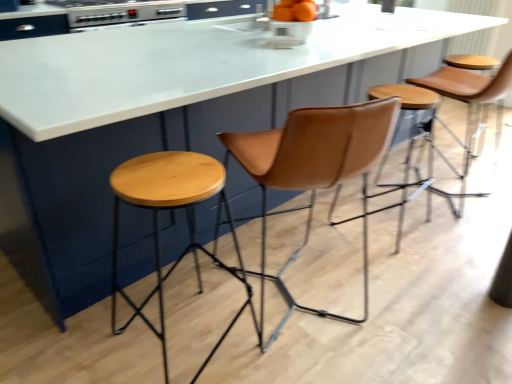
This screenshot has height=384, width=512. What do you see at coordinates (124, 15) in the screenshot?
I see `metallic silver oven at upper left` at bounding box center [124, 15].

Describe the element at coordinates (315, 169) in the screenshot. Image resolution: width=512 pixels, height=384 pixels. I see `brown leather swivel chair at center` at that location.

What do you see at coordinates (295, 11) in the screenshot? I see `orange matte bowl at center` at bounding box center [295, 11].

What do you see at coordinates (413, 148) in the screenshot? I see `leather stool at center, the second stool from the front` at bounding box center [413, 148].

This screenshot has height=384, width=512. What are the coordinates of `metallic silver oven at upper left` in the screenshot? It's located at (124, 15).

Is point (169, 185) positioned behind point (137, 20)?

No.

From the image's perspective, relative to metallic silver oven at upper left, is natural wood stool at left, positioned as the 2th stool in right-to-left order, above or below?

Based on their image positions, natural wood stool at left, positioned as the 2th stool in right-to-left order, is located beneath metallic silver oven at upper left.

Does natural wood stool at left, which is counted as the second stool, starting from the back, have a greater height compared to metallic silver oven at upper left?

Yes.

How much distance is there between natural wood stool at left, positioned as the 2th stool in right-to-left order, and metallic silver oven at upper left?

natural wood stool at left, positioned as the 2th stool in right-to-left order, is 2.05 meters from metallic silver oven at upper left.

Could you tell me if leather stool at center, the second stool positioned from the left, is turned towards natural wood stool at left, which is counted as the second stool, starting from the back?

No, leather stool at center, the second stool positioned from the left, is not turned towards natural wood stool at left, which is counted as the second stool, starting from the back.

Can you confirm if leather stool at center, the second stool positioned from the left, is positioned to the left of natural wood stool at left, which is counted as the second stool, starting from the back?

Incorrect, leather stool at center, the second stool positioned from the left, is not on the left side of natural wood stool at left, which is counted as the second stool, starting from the back.

Consider the image. Is leather stool at center, the second stool from the front, closer to the viewer compared to natural wood stool at left, which is counted as the second stool, starting from the back?

No, leather stool at center, the second stool from the front, is behind natural wood stool at left, which is counted as the second stool, starting from the back.

From the image's perspective, is leather stool at center, the 1th stool from the back, above or below natural wood stool at left, the first stool from the front?

From the image's perspective, leather stool at center, the 1th stool from the back, appears above natural wood stool at left, the first stool from the front.

Which is closer to the camera, (394, 85) or (139, 10)?

The point (394, 85) is closer.

Looking at this image, from the image's perspective, is leather stool at center, the second stool from the front, above metallic silver oven at upper left?

No, from the image's perspective, leather stool at center, the second stool from the front, is not on top of metallic silver oven at upper left.

Can metallic silver oven at upper left be found inside leather stool at center, the second stool positioned from the left?

No, metallic silver oven at upper left is not inside leather stool at center, the second stool positioned from the left.

From a real-world perspective, is orange matte bowl at center above or below brown leather swivel chair at center?

Clearly, from a real-world perspective, orange matte bowl at center is above brown leather swivel chair at center.

Does orange matte bowl at center appear on the right side of brown leather swivel chair at center?

Yes, orange matte bowl at center is to the right of brown leather swivel chair at center.

The image size is (512, 384). Identify the location of swivel chair in front of the orange matte bowl at center. (315, 169).

Can you tell me how much metallic silver oven at upper left and orange matte bowl at center differ in facing direction?

metallic silver oven at upper left and orange matte bowl at center are facing 1.05 degrees away from each other.

Is metallic silver oven at upper left outside of orange matte bowl at center?

Indeed, metallic silver oven at upper left is completely outside orange matte bowl at center.

Is metallic silver oven at upper left thinner than orange matte bowl at center?

No.

Where is `orange in front of the metallic silver oven at upper left`? The width and height of the screenshot is (512, 384). orange in front of the metallic silver oven at upper left is located at coordinates (295, 11).

Is brown leather swivel chair at center facing towards leather stool at center, the second stool from the front?

No, brown leather swivel chair at center does not turn towards leather stool at center, the second stool from the front.

Based on their positions, is brown leather swivel chair at center located to the left or right of leather stool at center, the second stool from the front?

Clearly, brown leather swivel chair at center is on the left of leather stool at center, the second stool from the front, in the image.

From a real-world perspective, is brown leather swivel chair at center above or below leather stool at center, which ranks as the 1th stool in right-to-left order?

From a real-world perspective, brown leather swivel chair at center is physically above leather stool at center, which ranks as the 1th stool in right-to-left order.

Can natural wood stool at left, which is counted as the second stool, starting from the back, be found inside orange matte bowl at center?

No, natural wood stool at left, which is counted as the second stool, starting from the back, is not inside orange matte bowl at center.

Is orange matte bowl at center in front of or behind natural wood stool at left, which is the first stool from left to right, in the image?

orange matte bowl at center is behind natural wood stool at left, which is the first stool from left to right.

From the image's perspective, would you say orange matte bowl at center is shown under natural wood stool at left, which is counted as the second stool, starting from the back?

No, from the image's perspective, orange matte bowl at center is not beneath natural wood stool at left, which is counted as the second stool, starting from the back.

At what (x,y) coordinates should I click in order to perform the action: click on appliance that is above the natural wood stool at left, the first stool from the front (from the image's perspective). Please return your answer as a coordinate pair (x, y). Image resolution: width=512 pixels, height=384 pixels. Looking at the image, I should click on (124, 15).

The image size is (512, 384). What are the coordinates of `stool that appears below the leather stool at center, which ranks as the 1th stool in right-to-left order (from a real-world perspective)` in the screenshot? It's located at (159, 224).

Looking at the image, which one is located further to brown leather swivel chair at center, leather stool at center, the second stool from the front, or metallic silver oven at upper left?

metallic silver oven at upper left is further to brown leather swivel chair at center.

Estimate the real-world distances between objects in this image. Which object is closer to leather stool at center, the second stool positioned from the left, brown leather swivel chair at center or natural wood stool at left, the first stool from the front?

natural wood stool at left, the first stool from the front, is positioned closer to the anchor leather stool at center, the second stool positioned from the left.

Which object lies further to the anchor point orange matte bowl at center, natural wood stool at left, positioned as the 2th stool in right-to-left order, or metallic silver oven at upper left?

Based on the image, metallic silver oven at upper left appears to be further to orange matte bowl at center.

Which object lies nearer to the anchor point orange matte bowl at center, leather stool at center, the second stool positioned from the left, or metallic silver oven at upper left?

leather stool at center, the second stool positioned from the left.

Looking at this image, based on their spatial positions, is brown leather swivel chair at center or metallic silver oven at upper left closer to leather stool at center, the second stool from the front?

brown leather swivel chair at center is positioned closer to the anchor leather stool at center, the second stool from the front.

From the image, which object appears to be farther from natural wood stool at left, positioned as the 2th stool in right-to-left order, leather stool at center, the second stool positioned from the left, or brown leather swivel chair at center?

leather stool at center, the second stool positioned from the left, is positioned further to the anchor natural wood stool at left, positioned as the 2th stool in right-to-left order.

Based on their spatial positions, is orange matte bowl at center or brown leather swivel chair at center further from metallic silver oven at upper left?

brown leather swivel chair at center is further to metallic silver oven at upper left.

Which object lies nearer to the anchor point brown leather swivel chair at center, metallic silver oven at upper left or leather stool at center, which ranks as the 1th stool in right-to-left order?

leather stool at center, which ranks as the 1th stool in right-to-left order.

Find the location of a particular element. Image resolution: width=512 pixels, height=384 pixels. swivel chair between natural wood stool at left, the first stool from the front, and leather stool at center, the second stool positioned from the left is located at coordinates (315, 169).

I want to click on swivel chair positioned between natural wood stool at left, which is the first stool from left to right, and metallic silver oven at upper left from near to far, so click(315, 169).

The width and height of the screenshot is (512, 384). Identify the location of stool between orange matte bowl at center and natural wood stool at left, the first stool from the front, vertically. (413, 148).

This screenshot has height=384, width=512. In order to click on stool between orange matte bowl at center and brown leather swivel chair at center vertically in this screenshot , I will do `click(413, 148)`.